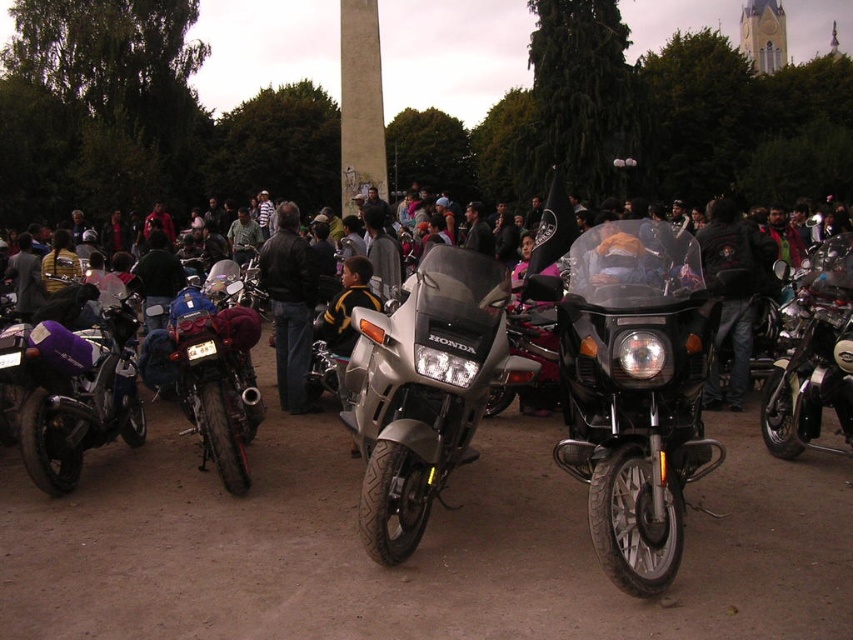
You are a delivery person who needs to place a package between the brushed metal motorcycle at center and the black leather jacket at center. The package requires a minimum space of 30 feet to be placed safely. Can you safely place the package between them?

The distance between the brushed metal motorcycle at center and the black leather jacket at center is 29.38 feet, which is less than the required 30 feet. Therefore, you cannot safely place the package between them.

You are a photographer trying to capture a clear shot of the brushed metal motorcycle at center and the black leather jacket at center. Since you want to focus on the motorcycle, which object should you adjust your camera angle to avoid blocking the view of the motorcycle?

The black leather jacket at center is taller than the brushed metal motorcycle at center, so adjusting the camera angle to avoid the black leather jacket at center will prevent it from blocking the view of the motorcycle.